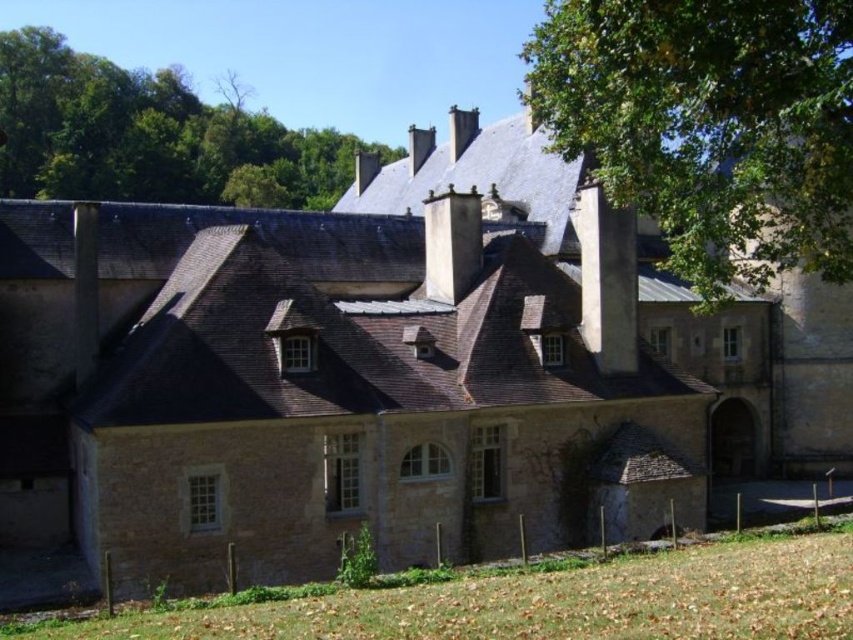
You are standing at a point 46.29 meters away from the point labeled as point (648, 164) on the historic stone building. If you want to take a photo of the entire building, would you need to zoom in or out your camera lens?

Since you are 46.29 meters away from point (648, 164) on the historic stone building, you would need to zoom out to capture the entire building in the photo.

You are standing in front of the historic stone building and want to take a photo. You notice two points marked on the building. One is at point coordinates point (109, 113) and the other at point (631, 236). Which point is closer to your camera?

Point (109, 113) is closer to the camera than point (631, 236) because it is further to the camera than the other point.

You are a drone operator tasked with capturing aerial footage of the historic stone building. Your drone has a maximum flight range of 8 meters. You need to fly from the white stone chimney at upper center to the white stone chimney at center. Will your drone be able to complete this flight without exceeding its range?

The distance between the white stone chimney at upper center and the white stone chimney at center is 8.48 meters, which exceeds the drone operator s 8 meter range. Therefore, the drone will not be able to complete the flight without exceeding its range.